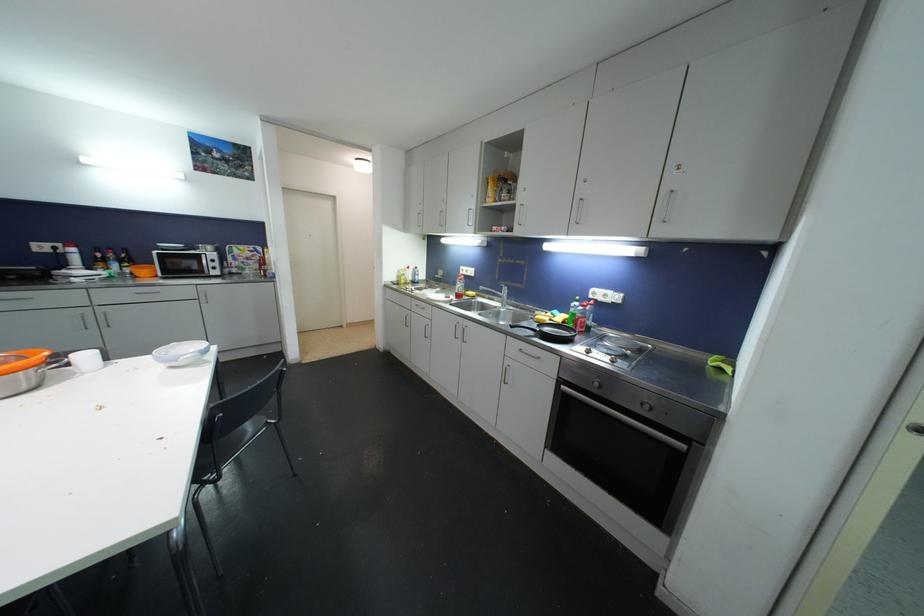
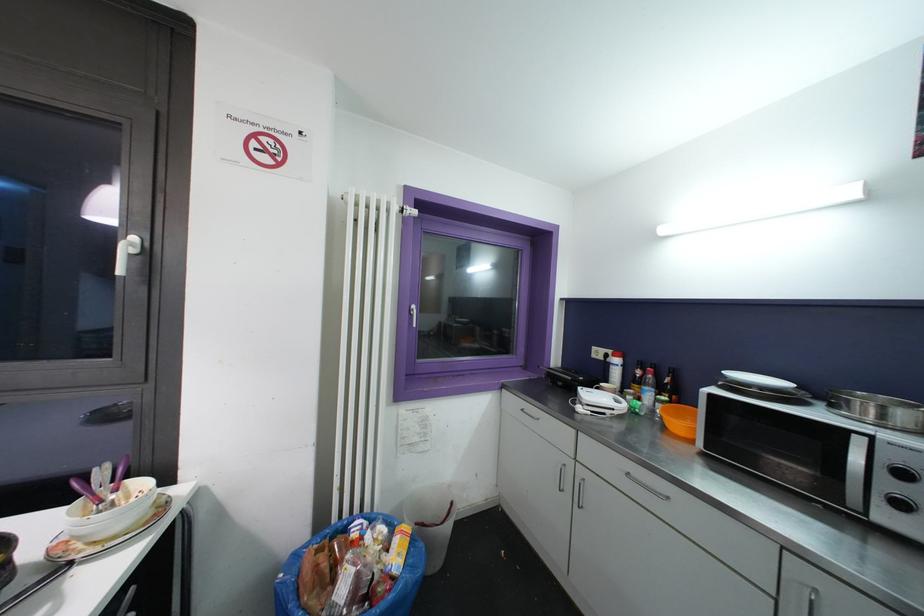
Find the pixel in the second image that matches [215,264] in the first image.

(906, 477)